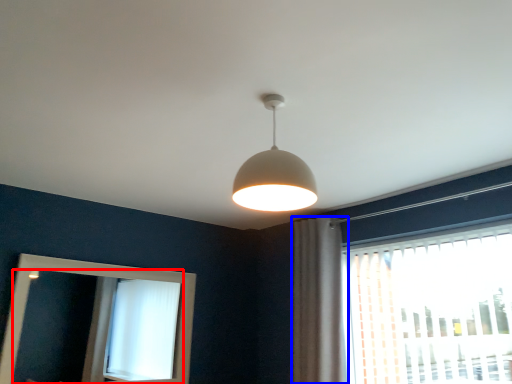
Question: Which object is further to the camera taking this photo, mirror (highlighted by a red box) or curtain (highlighted by a blue box)?

Choices:
 (A) mirror
 (B) curtain

Answer: (B)